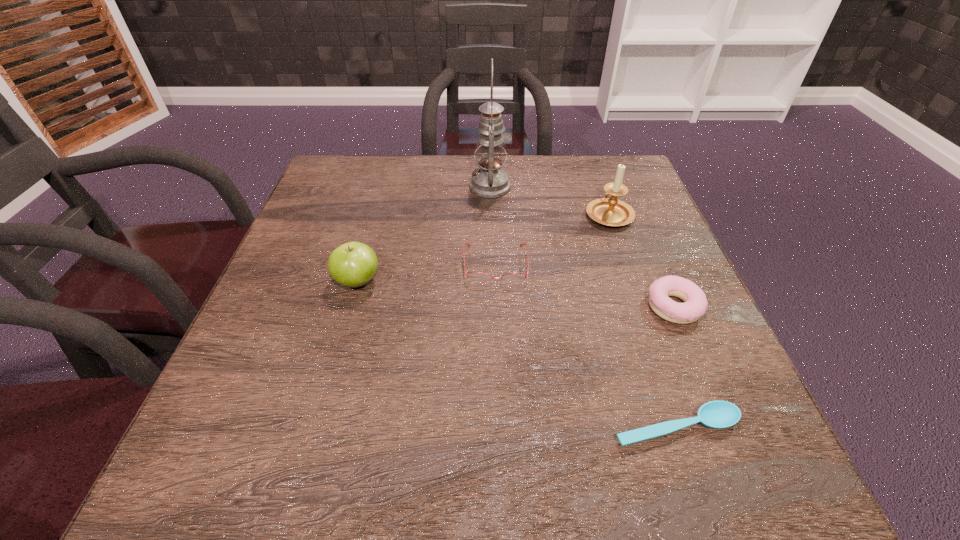
Point out which object is positioned as the nearest to the spoon. Please provide its 2D coordinates. Your answer should be formatted as a tuple, i.e. [(x, y)], where the tuple contains the x and y coordinates of a point satisfying the conditions above.

[(695, 304)]

Identify which object is the fourth closest to the apple. Please provide its 2D coordinates. Your answer should be formatted as a tuple, i.e. [(x, y)], where the tuple contains the x and y coordinates of a point satisfying the conditions above.

[(608, 211)]

Identify the location of free location that satisfies the following two spatial constraints: 1. on the lenses of the fifth tallest object; 2. on the right side of the spoon. This screenshot has height=540, width=960. (502, 428).

Where is `vacant space that satisfies the following two spatial constraints: 1. on the lenses of the shortest object; 2. on the left side of the spectacles`? vacant space that satisfies the following two spatial constraints: 1. on the lenses of the shortest object; 2. on the left side of the spectacles is located at coordinates (502, 428).